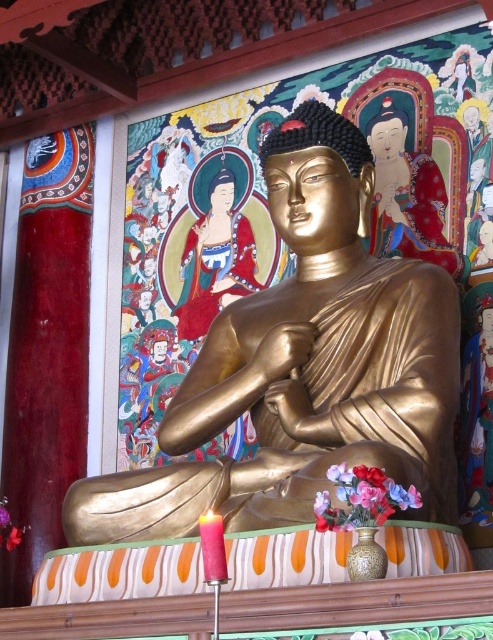
You are an interior designer planning to place a 1.5 meter wide sofa in the room where the gold polished statue at center and smooth gold statue at center are located. According to the spatial arrangement, will the sofa fit between these two statues?

The gold polished statue at center and smooth gold statue at center are 16.03 meters apart. Since the sofa is 1.5 meters wide, there is sufficient space between them to accommodate the sofa.